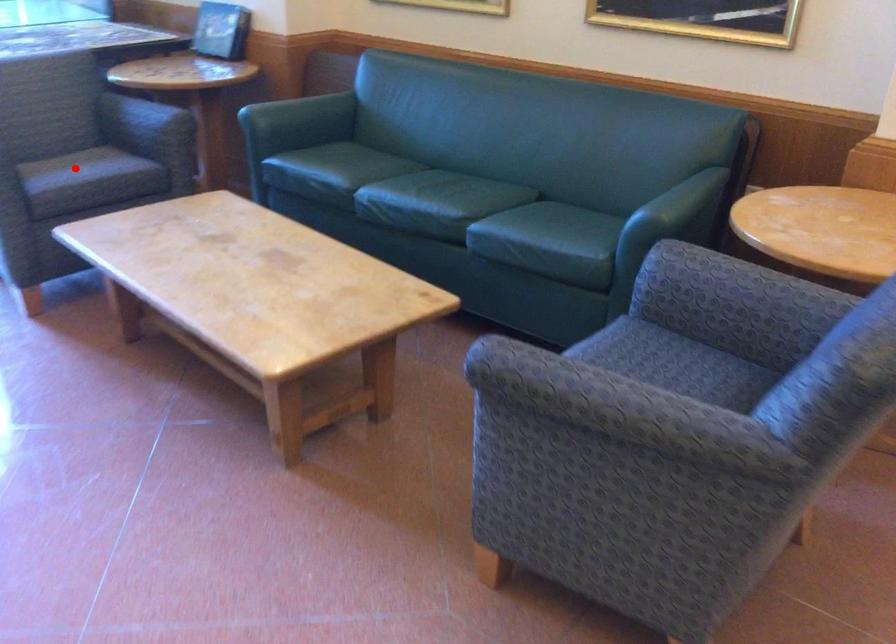
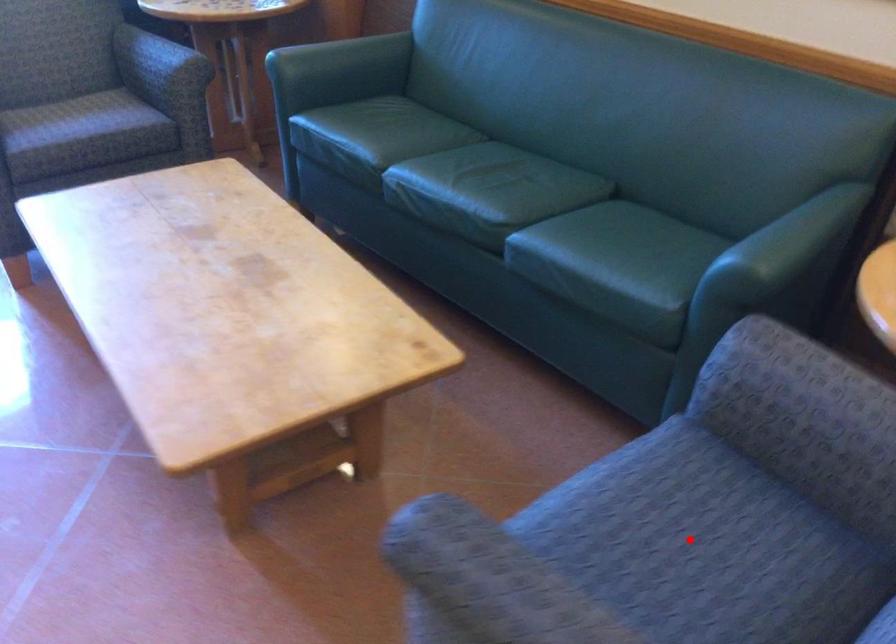
I am providing you with two images of the same scene from different viewpoints. A red point is marked on the first image and another point is marked on the second image. Does the point marked in image1 correspond to the same location as the one in image2?

No